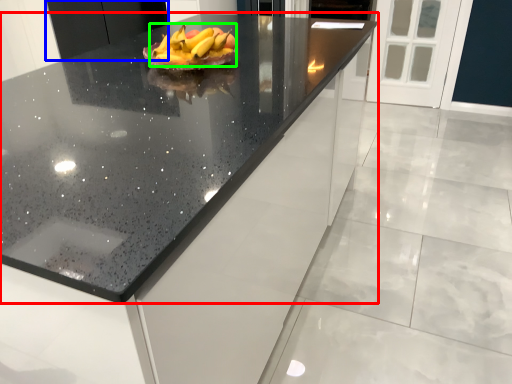
Question: Which object is positioned closest to countertop (highlighted by a red box)? Select from cabinetry (highlighted by a blue box) and grapefruit (highlighted by a green box).

Choices:
 (A) cabinetry
 (B) grapefruit

Answer: (B)